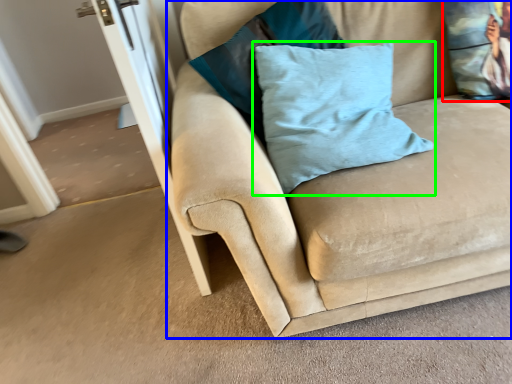
Question: Based on their relative distances, which object is nearer to pillow (highlighted by a red box)? Choose from studio couch (highlighted by a blue box) and pillow (highlighted by a green box).

Choices:
 (A) studio couch
 (B) pillow

Answer: (A)